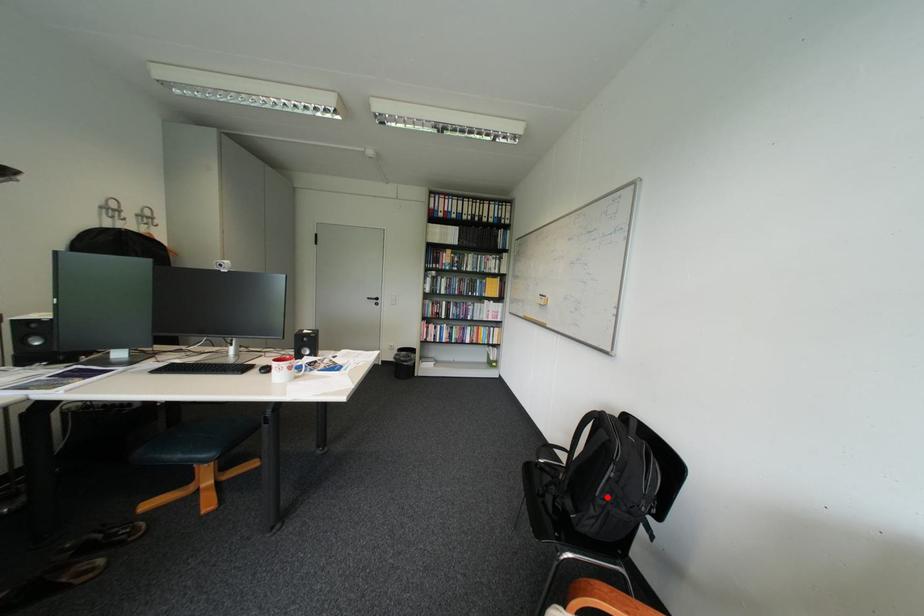
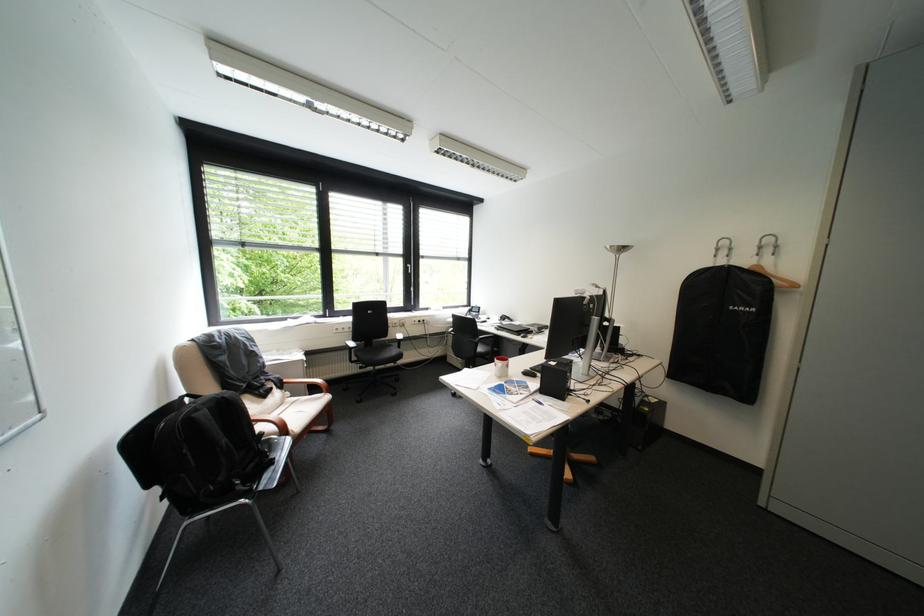
Question: A red point is marked in image1. In image2, is the corresponding 3D point closer to the camera or farther? Reply with the corresponding letter.

Choices:
 (A) The corresponding 3D point is closer.
 (B) The corresponding 3D point is farther.

Answer: (A)